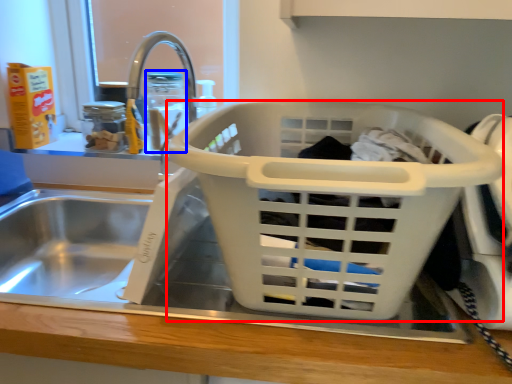
Question: Which object appears farthest to the camera in this image, basket (highlighted by a red box) or bottle (highlighted by a blue box)?

Choices:
 (A) basket
 (B) bottle

Answer: (B)